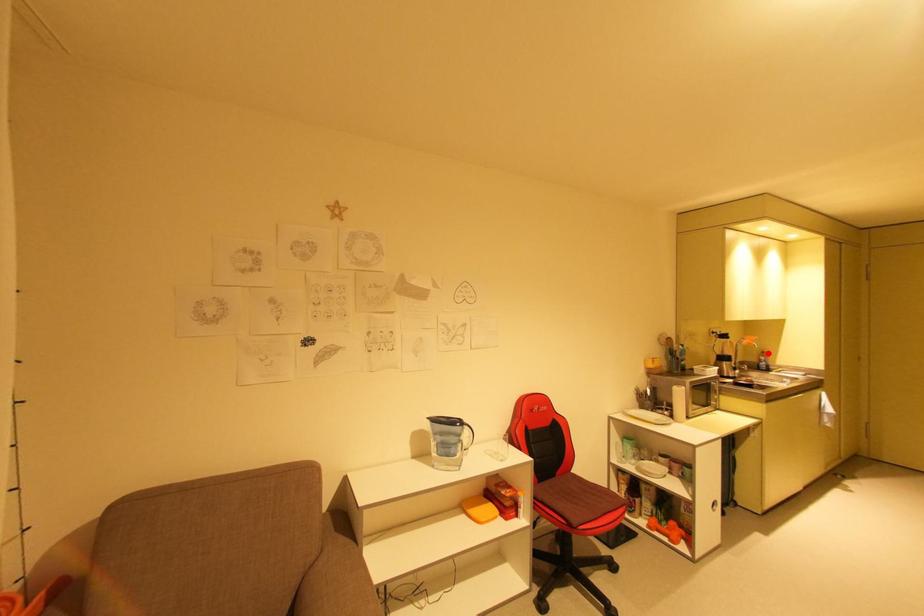
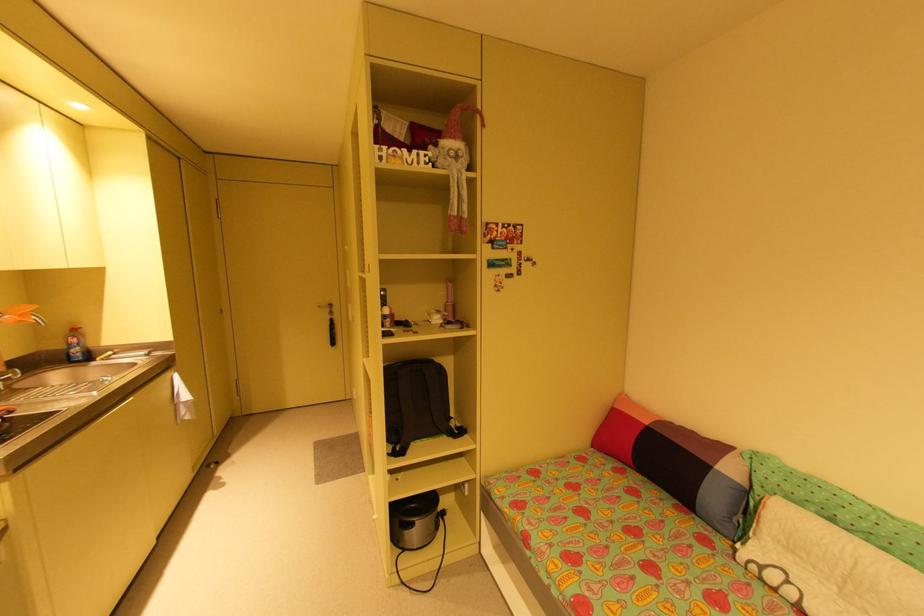
Find the pixel in the second image that matches the highlighted location in the first image.

(79, 331)